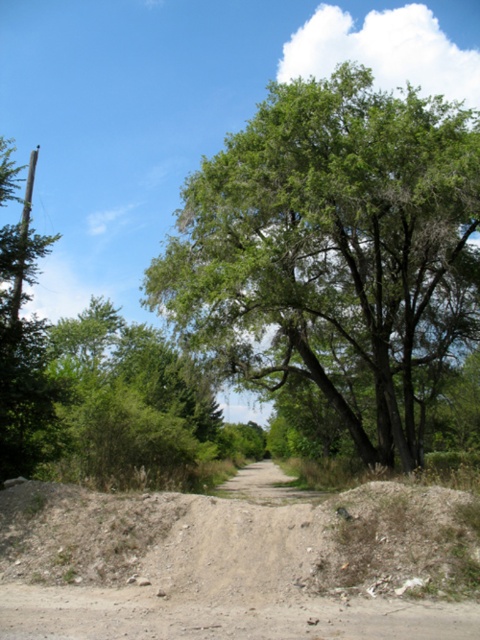
You are standing at the origin point of the image. Which direction should you move to reach the green leafy tree at center?

The green leafy tree at center is located at coordinates point (332, 252), so you should move towards the center of the image to reach it.

You are a hiker trying to navigate the brown gravel dirt track at center. There is a green leafy tree at left overhead. If you look up while walking on the track, will you see the tree above you?

Yes, the brown gravel dirt track at center is below the green leafy tree at left, so looking up while walking on the track will show the tree above.